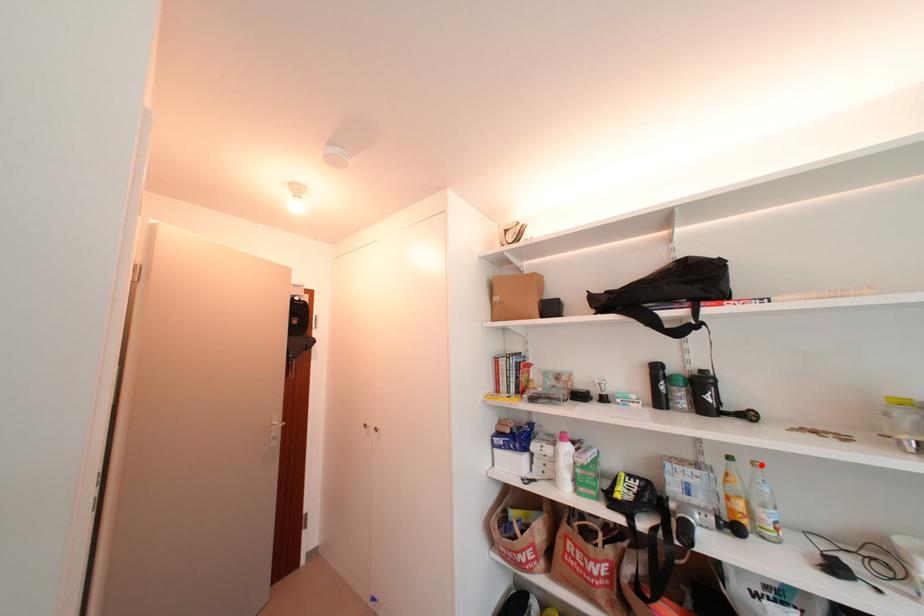
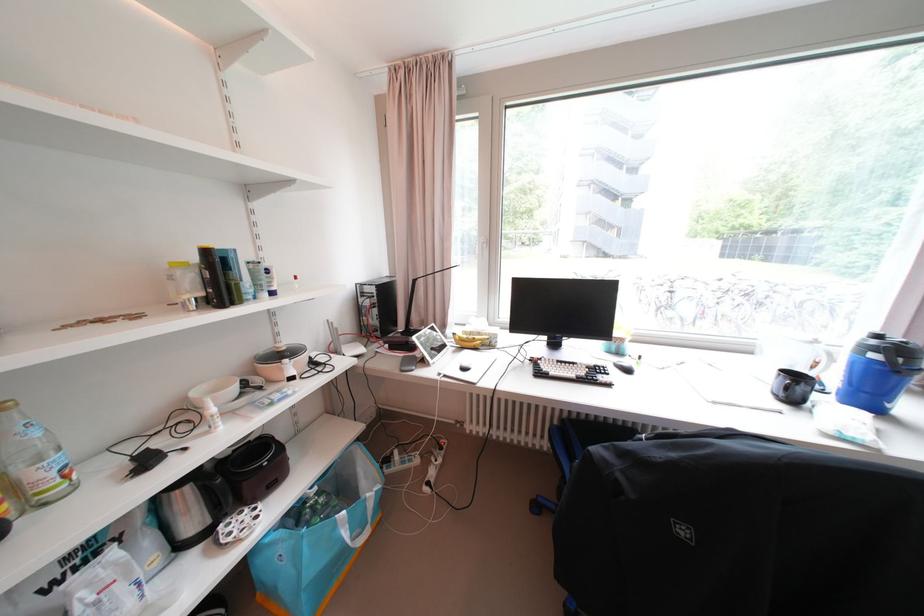
Find the pixel in the second image that matches the highlighted location in the first image.

(6, 410)